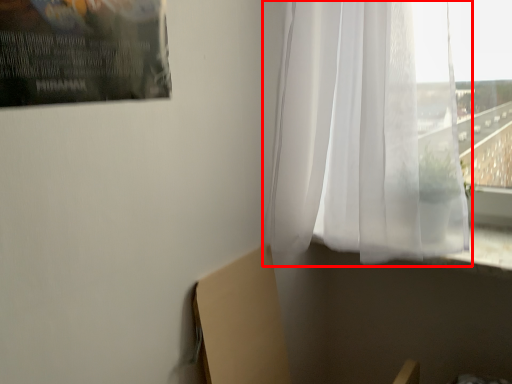
Question: From the image's perspective, what is the correct spatial relationship of curtain (annotated by the red box) in relation to cardboard box?

Choices:
 (A) above
 (B) below

Answer: (A)